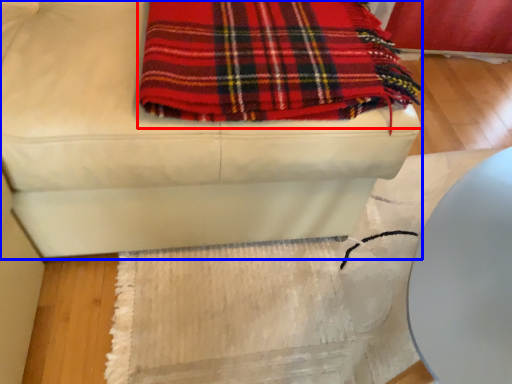
Question: Among these objects, which one is nearest to the camera, blanket (highlighted by a red box) or furniture (highlighted by a blue box)?

Choices:
 (A) blanket
 (B) furniture

Answer: (B)